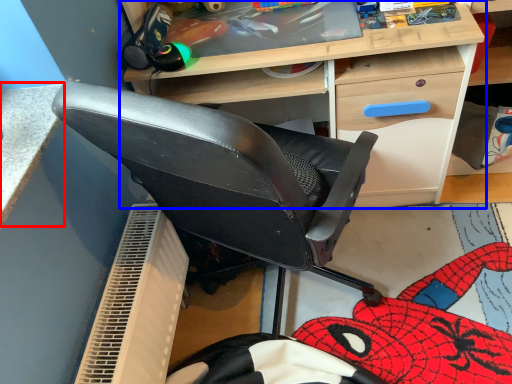
Question: Among these objects, which one is farthest to the camera, table (highlighted by a red box) or desk (highlighted by a blue box)?

Choices:
 (A) table
 (B) desk

Answer: (B)